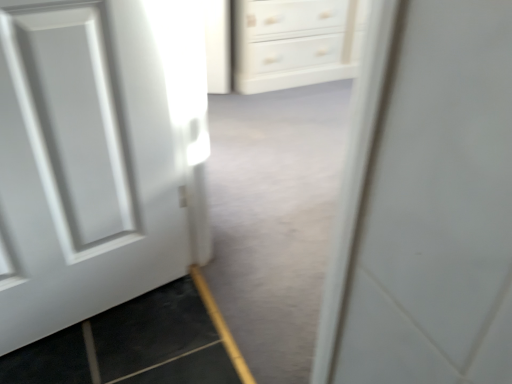
Identify the location of vacant space in front of white glossy chest of drawers at upper center. The width and height of the screenshot is (512, 384). (291, 110).